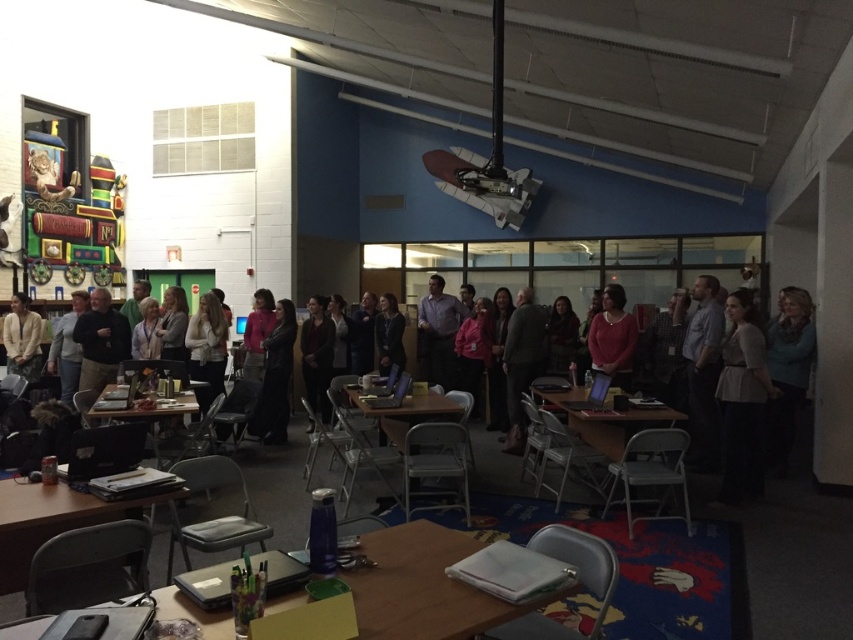
You are organizing a small group activity and need to choose between the wooden table at center and the wooden table at lower left. Which table has more space available for placing materials?

The wooden table at lower left has more space available because it occupies more space than the wooden table at center.

You are a photographer standing at the camera position. You need to place a small tripod on the wooden table at lower center. The tripod requires a minimum of 2 feet of space around it to avoid tipping over. Can you safely place the tripod on the table?

The wooden table at lower center and camera are 5.86 feet apart from each other. Since the distance between them is greater than the required 2 feet, you can safely place the tripod on the wooden table at lower center as there is enough space around it to avoid tipping over.